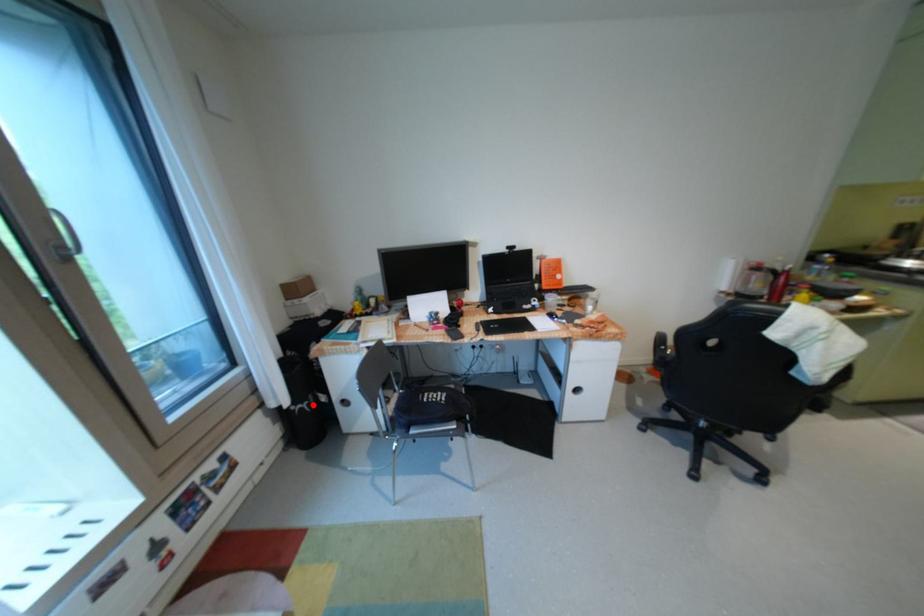
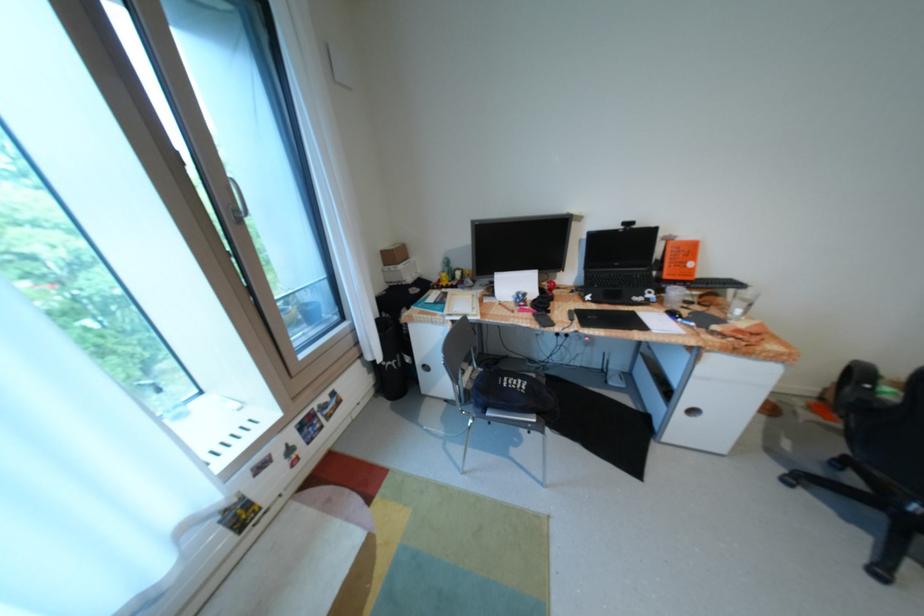
In the second image, find the point that corresponds to the highlighted location in the first image.

(402, 363)